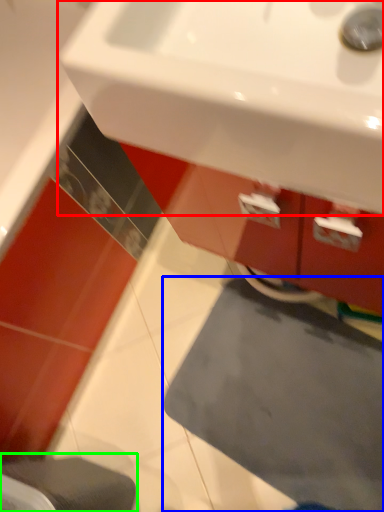
Question: Based on their relative distances, which object is nearer to sink (highlighted by a red box)? Choose from bath mat (highlighted by a blue box) and step stool (highlighted by a green box).

Choices:
 (A) bath mat
 (B) step stool

Answer: (B)